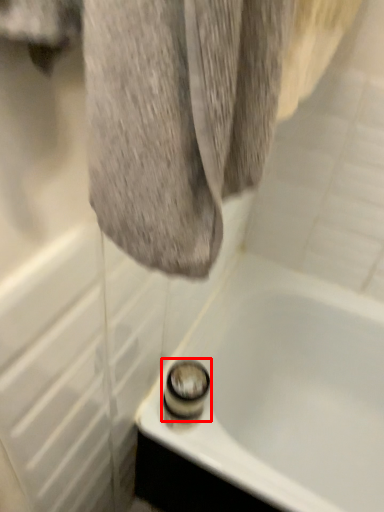
Question: From the image's perspective, where is shower (annotated by the red box) located in relation to bathtub in the image?

Choices:
 (A) above
 (B) below

Answer: (A)